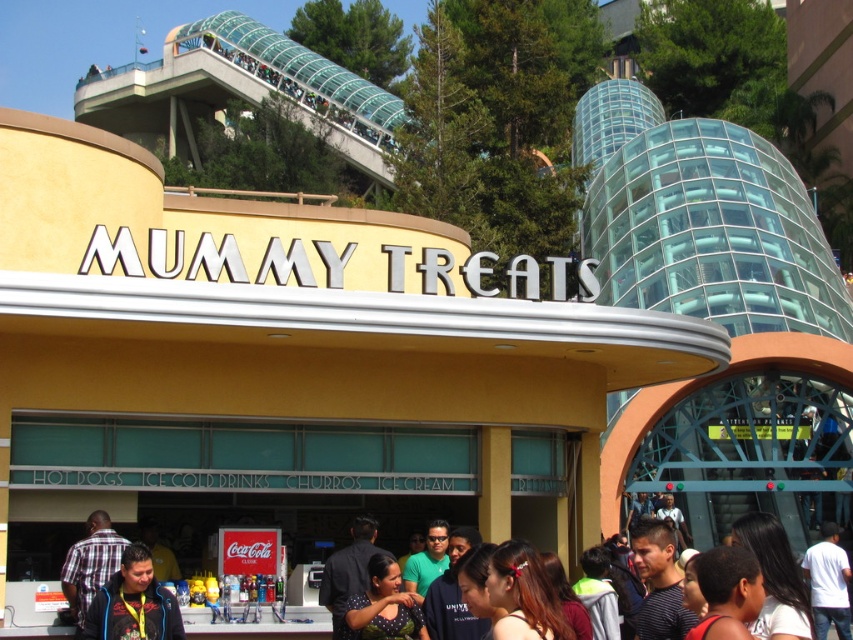
Does dark brown hair at center appear over dark blue jacket at lower left?

No.

Between dark brown hair at center and dark blue jacket at lower left, which one has more height?

Standing taller between the two is dark brown hair at center.

Is point (808, 548) farther from camera compared to point (115, 630)?

Yes.

Locate an element on the screen. This screenshot has width=853, height=640. dark brown hair at center is located at coordinates (793, 577).